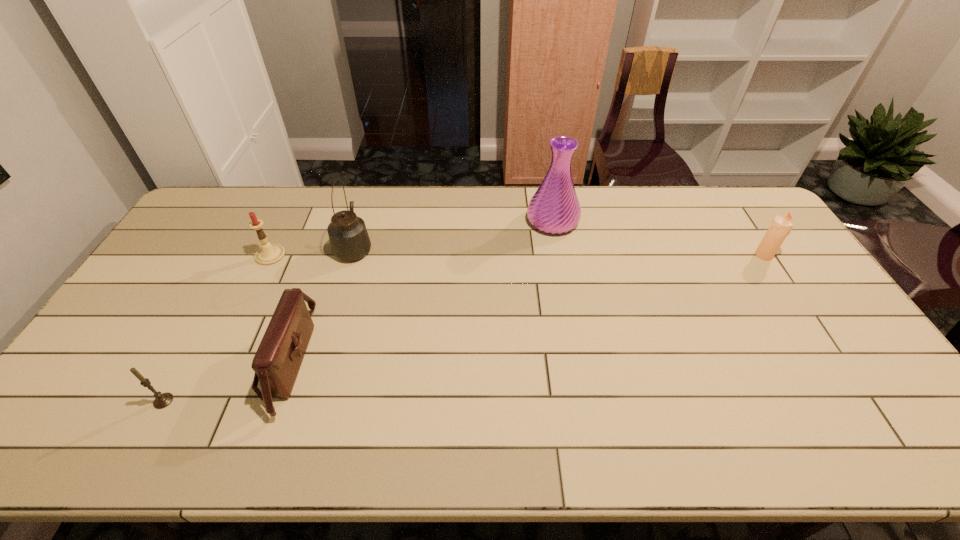
The width and height of the screenshot is (960, 540). I want to click on the fifth object from left to right, so click(x=554, y=208).

You are a GUI agent. You are given a task and a screenshot of the screen. Output one action in this format:
    pyautogui.click(x=<x>, y=<y>)
    Task: Click on the kettle
    This screenshot has height=540, width=960.
    Given the screenshot: What is the action you would take?
    pyautogui.click(x=349, y=239)

I want to click on the rightmost candle, so click(x=780, y=227).

At what (x,y) coordinates should I click in order to perform the action: click on the fifth object from right to left. Please return your answer as a coordinate pair (x, y). Looking at the image, I should click on (268, 254).

Image resolution: width=960 pixels, height=540 pixels. Find the location of `shoulder bag`. shoulder bag is located at coordinates (278, 359).

Where is `the shortest candle`? This screenshot has width=960, height=540. the shortest candle is located at coordinates (162, 400).

You are a GUI agent. You are given a task and a screenshot of the screen. Output one action in this format:
    pyautogui.click(x=<x>, y=<y>)
    Task: Click on the leftmost candle
    
    Given the screenshot: What is the action you would take?
    pyautogui.click(x=162, y=400)

This screenshot has height=540, width=960. Identify the location of vacant point located 0.230m on the front of the fifth object from left to right. (564, 288).

Where is `free space located spout on the kettle`? free space located spout on the kettle is located at coordinates (362, 220).

Locate an element on the screen. The height and width of the screenshot is (540, 960). vacant space located 0.120m spout on the kettle is located at coordinates (366, 208).